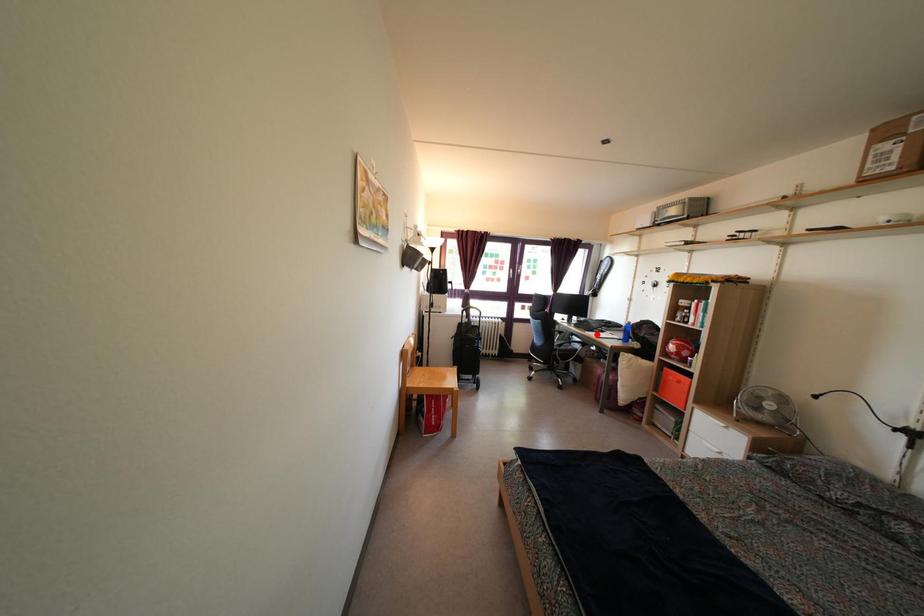
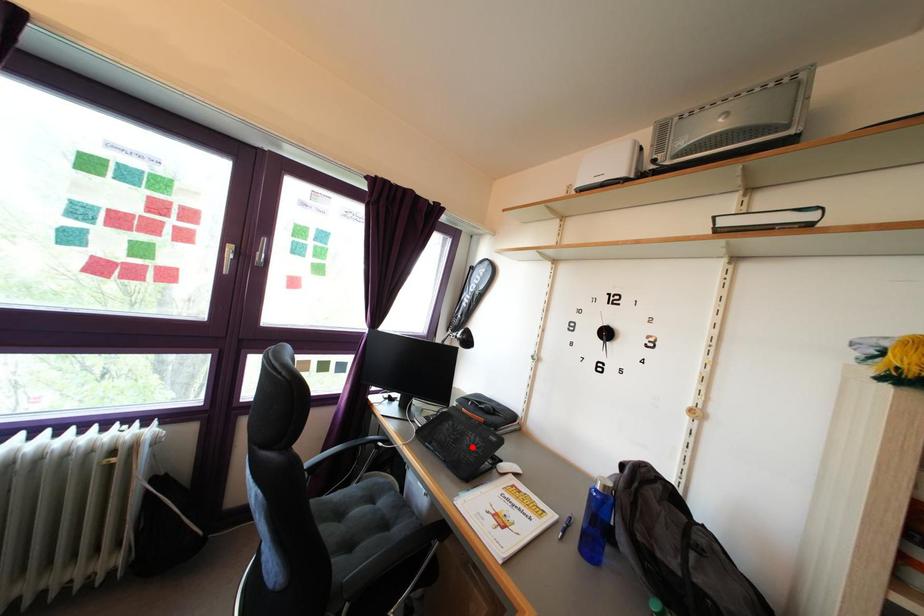
I am providing you with two images of the same scene from different viewpoints. A red point is marked on the first image and another point is marked on the second image. Do the highlighted points in image1 and image2 indicate the same real-world spot?

Yes